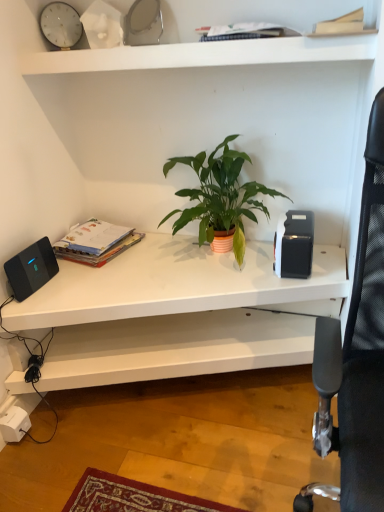
The width and height of the screenshot is (384, 512). In order to click on empty space that is in between black matte speaker at left and green matte plant at center in this screenshot , I will do `click(121, 280)`.